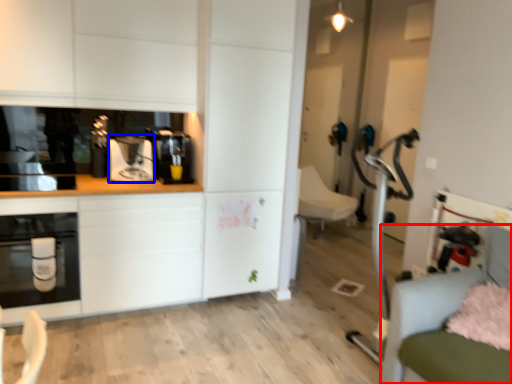
Question: Which of the following is the closest to the observer, swivel chair (highlighted by a red box) or coffee machine (highlighted by a blue box)?

Choices:
 (A) swivel chair
 (B) coffee machine

Answer: (A)